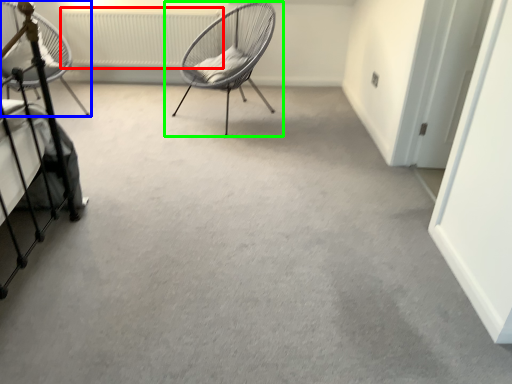
Question: Based on their relative distances, which object is nearer to radiator (highlighted by a red box)? Choose from chair (highlighted by a blue box) and chair (highlighted by a green box).

Choices:
 (A) chair
 (B) chair

Answer: (B)